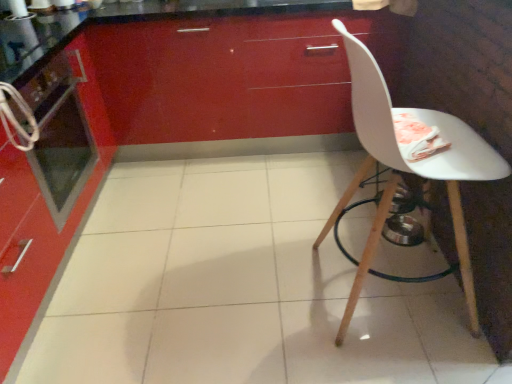
Question: In terms of size, does white matte chair at right appear bigger or smaller than metallic oven at left?

Choices:
 (A) small
 (B) big

Answer: (B)

Question: From their relative heights in the image, would you say white matte chair at right is taller or shorter than metallic oven at left?

Choices:
 (A) short
 (B) tall

Answer: (B)

Question: Considering the real-world distances, which object is farthest from the glossy red cabinet at upper center?

Choices:
 (A) metallic oven at left
 (B) white matte chair at right

Answer: (B)

Question: Which object is positioned farthest from the metallic oven at left?

Choices:
 (A) glossy red cabinet at upper center
 (B) white matte chair at right

Answer: (B)